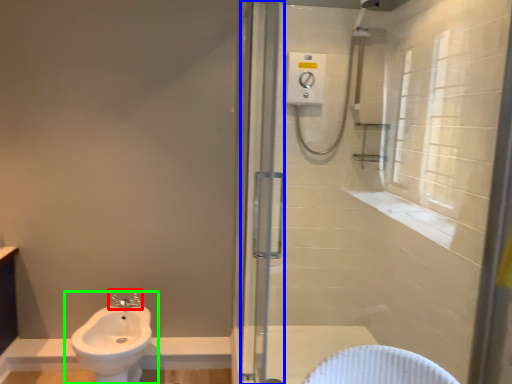
Question: Based on their relative distances, which object is nearer to tap (highlighted by a red box)? Choose from screen door (highlighted by a blue box) and sink (highlighted by a green box).

Choices:
 (A) screen door
 (B) sink

Answer: (B)